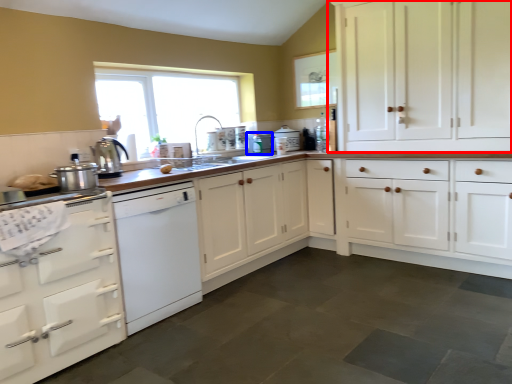
Question: Which object appears farthest to the camera in this image, cabinetry (highlighted by a red box) or appliance (highlighted by a blue box)?

Choices:
 (A) cabinetry
 (B) appliance

Answer: (B)